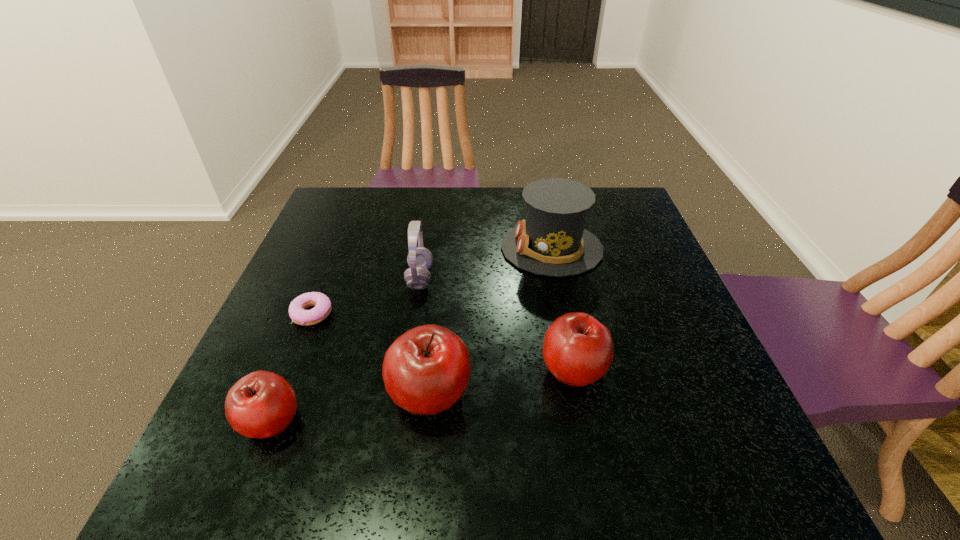
This screenshot has width=960, height=540. In order to click on object that is at the near left corner in this screenshot , I will do `click(262, 404)`.

I want to click on object that is at the far right corner, so click(x=552, y=240).

This screenshot has height=540, width=960. In the image, there is a desktop. What are the coordinates of `vacant space at the far edge` in the screenshot? It's located at (458, 229).

Identify the location of vacant space at the near edge of the desktop. This screenshot has width=960, height=540. (457, 435).

The width and height of the screenshot is (960, 540). I want to click on vacant space at the left edge, so click(351, 253).

Locate an element on the screen. vacant area at the far left corner is located at coordinates (374, 206).

Where is `free spot at the far right corner of the desktop`? Image resolution: width=960 pixels, height=540 pixels. free spot at the far right corner of the desktop is located at coordinates (604, 217).

Find the location of a particular element. The image size is (960, 540). free space at the near right corner of the desktop is located at coordinates (683, 439).

Where is `vacant area that lies between the second apple from left to right and the fourth nearest object`? The image size is (960, 540). vacant area that lies between the second apple from left to right and the fourth nearest object is located at coordinates (371, 354).

At what (x,y) coordinates should I click in order to perform the action: click on empty space that is in between the second tallest apple and the second apple from left to right. Please return your answer as a coordinate pair (x, y). Looking at the image, I should click on (501, 381).